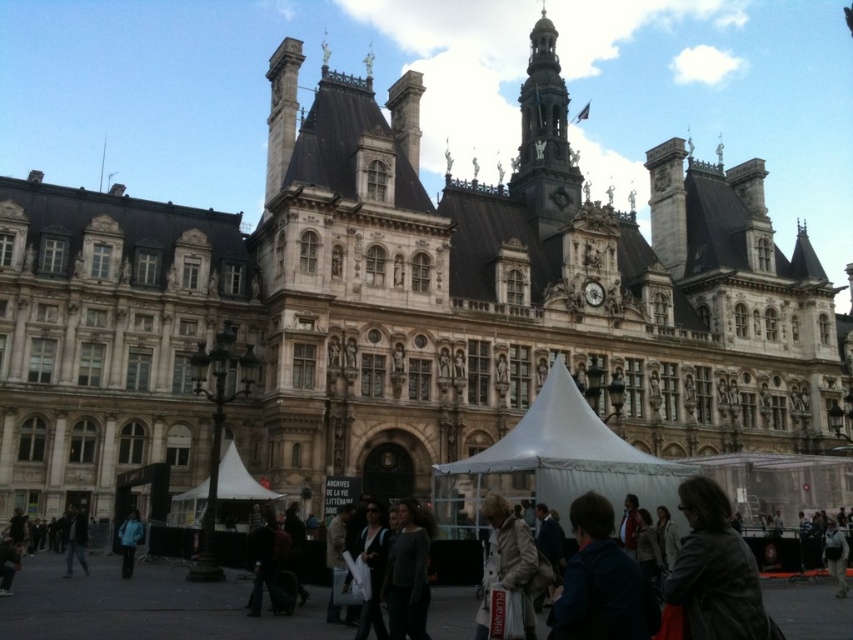
You are a photographer trying to capture a clear shot of the historic building. There are two people in the foreground wearing a leather jacket at center and a light beige coat at center. Which clothing item might block your view more if they are standing in front of the building?

The leather jacket at center might block your view more than the light beige coat at center since it is wider according to the description.

Looking at this image, you are a photographer planning to take a picture of the gold ornate clock tower at upper center and the blue fabric jacket at lower left from a distance. Based on their sizes in the image, which object would appear taller in the photo?

The gold ornate clock tower at upper center appears taller in the photo because it has a greater height compared to the blue fabric jacket at lower left.

You are a photographer standing at the front of the historic building. You want to take a picture that includes both the gold ornate clock tower at upper center and the blue fabric jacket at lower left. Based on their positions, will the clock tower appear above the jacket in the photo?

Yes, the gold ornate clock tower at upper center is positioned above the blue fabric jacket at lower left, so it will appear above the jacket in the photo.